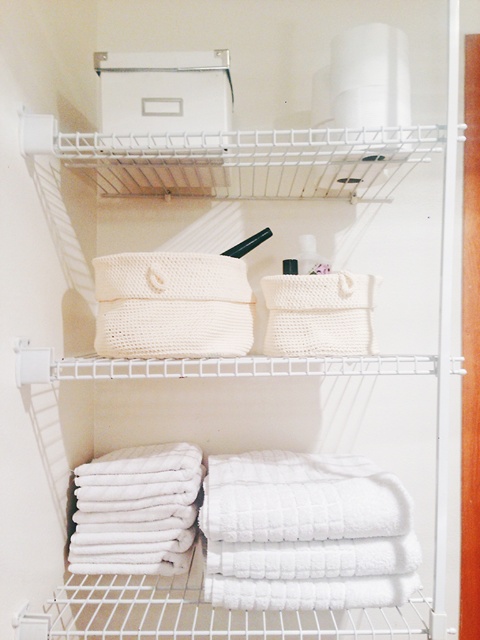
You are standing in front of the white wire shelving unit. There are two points marked on the middle shelf. One is at coordinates point (297, 256) and the other at point (289, 269). If you were to reach for the point that is closer to you, which coordinate would you touch?

Point (289, 269) is closer to you since it is in front of point (297, 256).

You are organizing your bathroom and have two toiletries to place on the same shelf. The white plastic toiletries at center and the matte black toiletry at center. Which one requires more space due to its size?

The white plastic toiletries at center requires more space because it has a larger size compared to the matte black toiletry at center.

You are organizing a bathroom and see the white plastic toiletries at center and the matte black toiletry at center. Which one is located to the right of the other?

The white plastic toiletries at center is positioned on the right side of matte black toiletry at center.